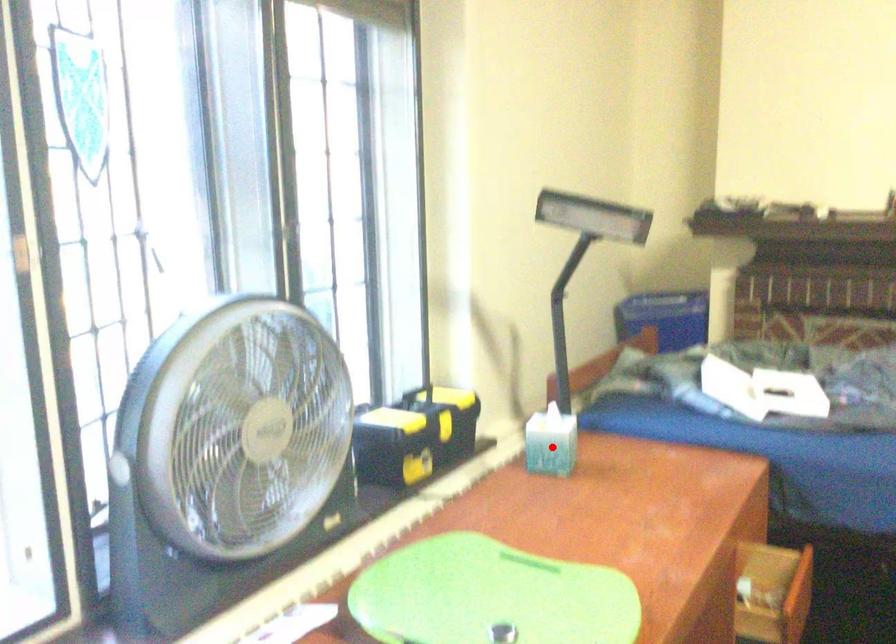
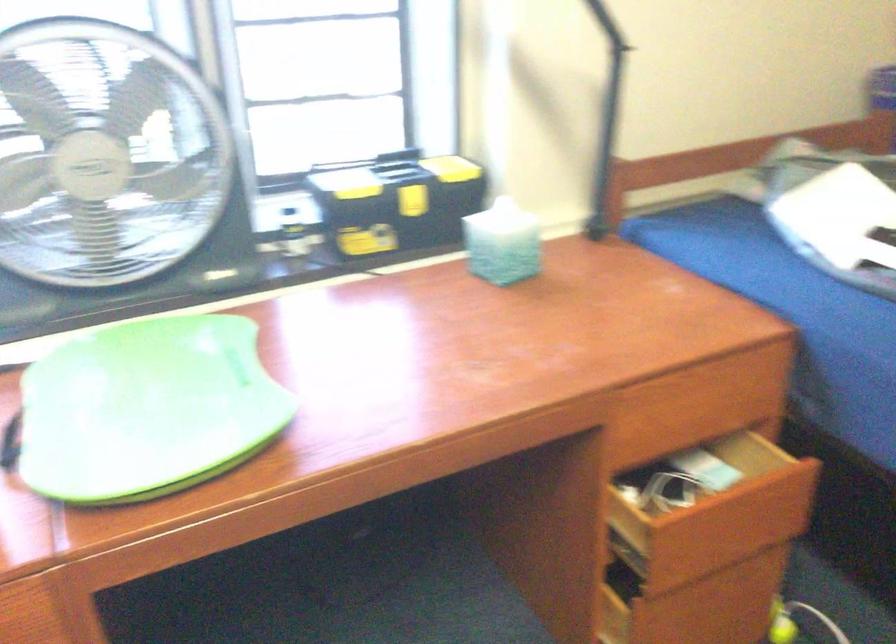
The point at the highlighted location is marked in the first image. Where is the corresponding point in the second image?

(503, 243)